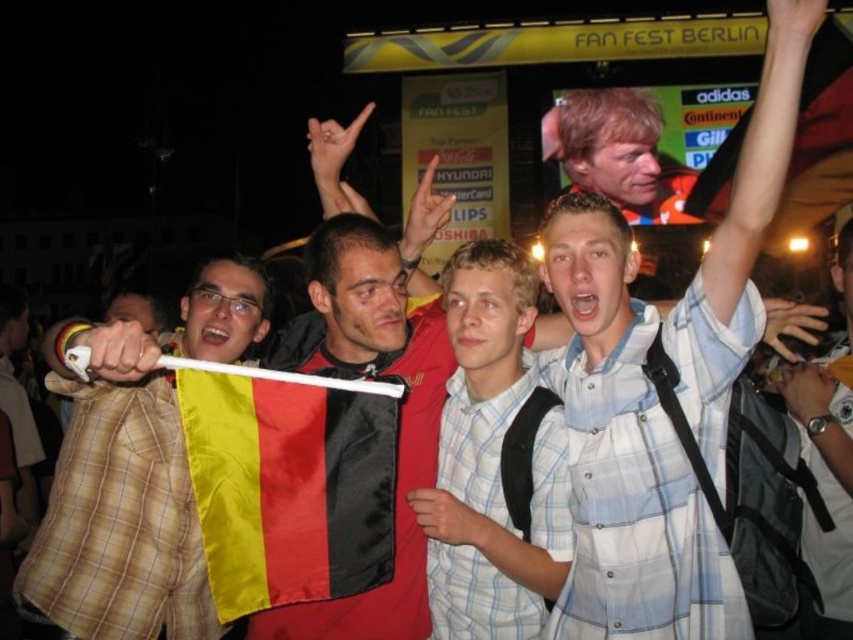
You are at the fan fest event in Berlin and want to take a photo of both the satin flag at center and the light blue plaid shirt at center. Since you want the flag to be taller in the photo, should you move closer or farther away from them?

The satin flag at center is shorter than the light blue plaid shirt at center. To make the flag appear taller in the photo, you should move closer to the satin flag at center so that its size in the frame increases relative to the shirt.

You are standing at the camera position and want to hand a gift to the person wearing the plaid shirt at left. Considering the distance between you and them, do you think you can throw the gift to them without needing to move closer?

The distance between you and the plaid shirt at left is 52.53 meters, so no, you cannot throw the gift to them without moving closer because that distance is too far for an accurate or safe throw.